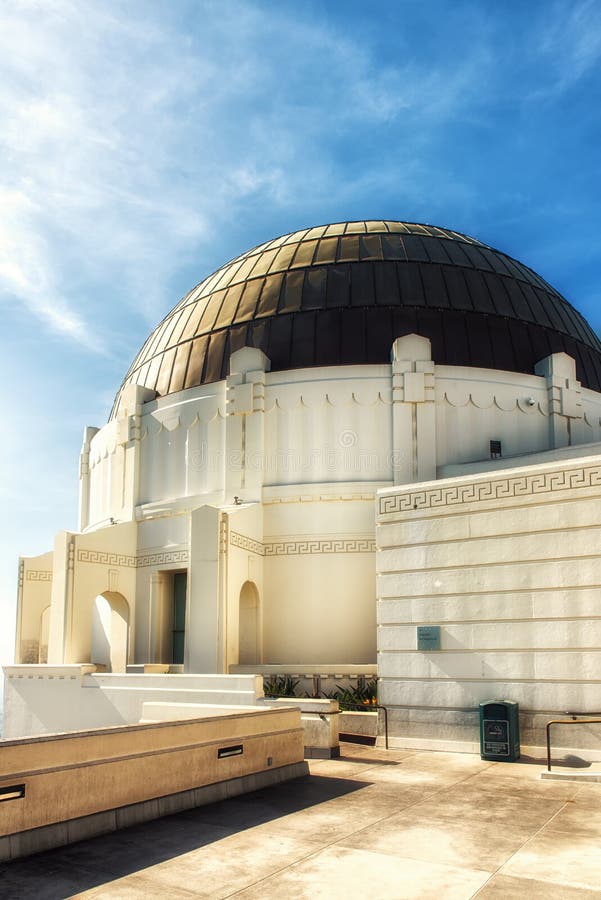
I want to click on trash can, so click(514, 721).